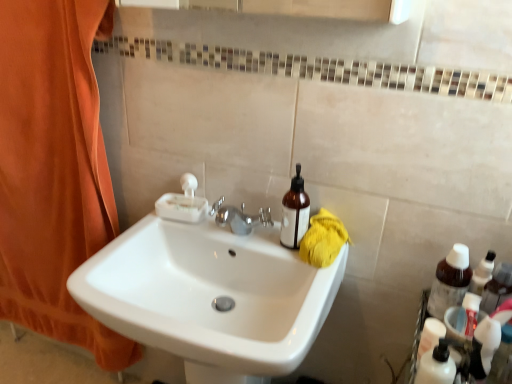
Question: Is orange fabric curtain at left to the left of brown translucent bottle at right from the viewer's perspective?

Choices:
 (A) yes
 (B) no

Answer: (A)

Question: Is orange fabric curtain at left wider than brown translucent bottle at right?

Choices:
 (A) no
 (B) yes

Answer: (B)

Question: Is orange fabric curtain at left completely or partially outside of brown translucent bottle at right?

Choices:
 (A) yes
 (B) no

Answer: (A)

Question: From a real-world perspective, is orange fabric curtain at left positioned over brown translucent bottle at right based on gravity?

Choices:
 (A) yes
 (B) no

Answer: (B)

Question: Does orange fabric curtain at left have a lesser height compared to brown translucent bottle at right?

Choices:
 (A) no
 (B) yes

Answer: (A)

Question: Can you confirm if orange fabric curtain at left is smaller than brown translucent bottle at right?

Choices:
 (A) no
 (B) yes

Answer: (A)

Question: Considering the relative positions of white glossy sink at center and brown translucent bottle at right in the image provided, is white glossy sink at center to the right of brown translucent bottle at right from the viewer's perspective?

Choices:
 (A) no
 (B) yes

Answer: (A)

Question: Considering the relative sizes of white glossy sink at center and brown translucent bottle at right in the image provided, is white glossy sink at center shorter than brown translucent bottle at right?

Choices:
 (A) yes
 (B) no

Answer: (B)

Question: Considering the relative sizes of white glossy sink at center and brown translucent bottle at right in the image provided, is white glossy sink at center taller than brown translucent bottle at right?

Choices:
 (A) no
 (B) yes

Answer: (B)

Question: Does white glossy sink at center turn towards brown translucent bottle at right?

Choices:
 (A) no
 (B) yes

Answer: (A)

Question: Considering the relative sizes of white glossy sink at center and brown translucent bottle at right in the image provided, is white glossy sink at center bigger than brown translucent bottle at right?

Choices:
 (A) no
 (B) yes

Answer: (B)

Question: From a real-world perspective, is white glossy sink at center beneath brown translucent bottle at right?

Choices:
 (A) yes
 (B) no

Answer: (A)

Question: Would you say brown translucent bottle at right contains white glossy sink at center?

Choices:
 (A) yes
 (B) no

Answer: (B)